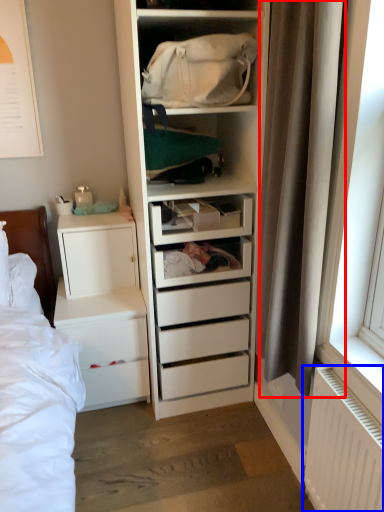
Question: Which object appears farthest to the camera in this image, curtain (highlighted by a red box) or radiator (highlighted by a blue box)?

Choices:
 (A) curtain
 (B) radiator

Answer: (B)